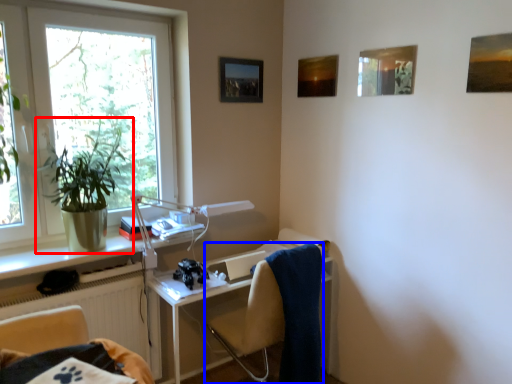
Question: Which of the following is the farthest to the observer, houseplant (highlighted by a red box) or chair (highlighted by a blue box)?

Choices:
 (A) houseplant
 (B) chair

Answer: (B)